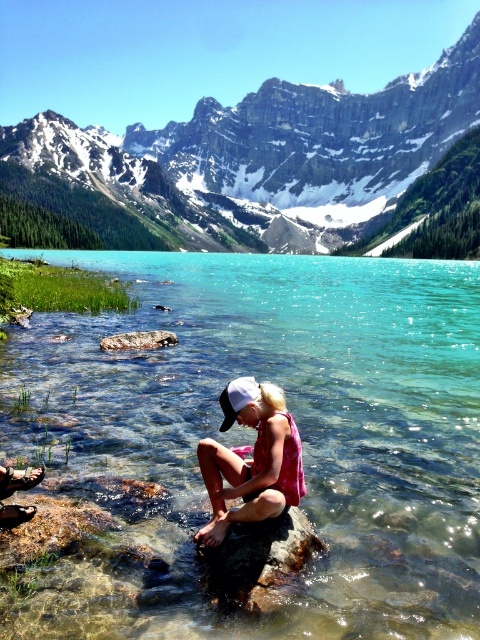
This screenshot has height=640, width=480. What do you see at coordinates (268, 157) in the screenshot? I see `snowy granite mountain at upper center` at bounding box center [268, 157].

Who is more distant from viewer, (199, 246) or (273, 474)?

Point (199, 246)

Locate an element on the screen. The height and width of the screenshot is (640, 480). snowy granite mountain at upper center is located at coordinates (268, 157).

In the scene shown: Between snowy granite mountain at upper center and smooth gray rock at lower center, which one is positioned higher?

snowy granite mountain at upper center is above.

Can you confirm if snowy granite mountain at upper center is smaller than smooth gray rock at lower center?

Incorrect, snowy granite mountain at upper center is not smaller in size than smooth gray rock at lower center.

Between point (369, 218) and point (296, 516), which one is positioned in front?

Point (296, 516) is in front.

The width and height of the screenshot is (480, 640). I want to click on snowy granite mountain at upper center, so click(268, 157).

Who is shorter, pink fabric at center or smooth gray rock at lower left?

smooth gray rock at lower left

Can you confirm if pink fabric at center is positioned below smooth gray rock at lower left?

Indeed, pink fabric at center is positioned under smooth gray rock at lower left.

Is point (253, 452) behind point (153, 332)?

No, it is not.

This screenshot has height=640, width=480. I want to click on pink fabric at center, so click(252, 460).